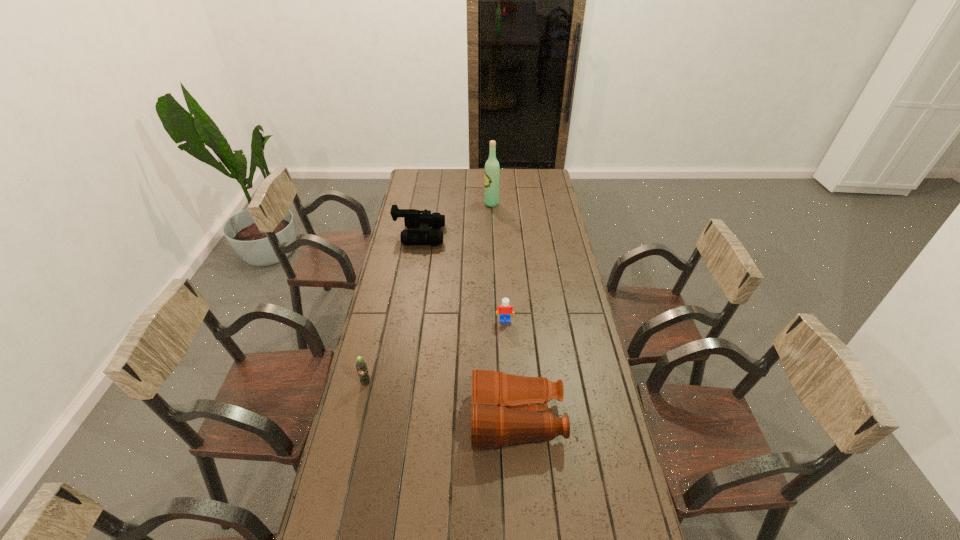
At what (x,y) coordinates should I click in order to perform the action: click on object that is the fourth closest to the right binoculars. Please return your answer as a coordinate pair (x, y). Image resolution: width=960 pixels, height=540 pixels. Looking at the image, I should click on (492, 168).

Find the location of a particular element. blank area in the image that satisfies the following two spatial constraints: 1. on the front lenses of the second farthest object; 2. on the front label of the soda is located at coordinates (394, 383).

Locate an element on the screen. Image resolution: width=960 pixels, height=540 pixels. vacant region that satisfies the following two spatial constraints: 1. on the front-facing side of the farthest object; 2. on the front label of the soda is located at coordinates (498, 383).